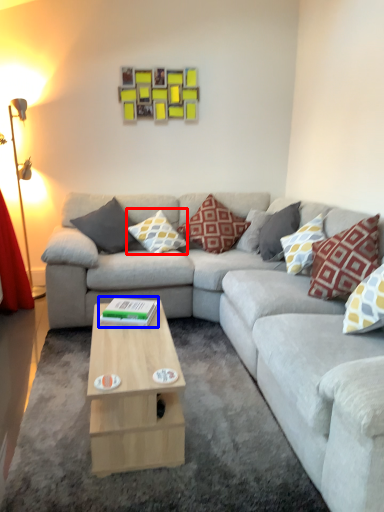
Question: Among these objects, which one is nearest to the camera, pillow (highlighted by a red box) or book (highlighted by a blue box)?

Choices:
 (A) pillow
 (B) book

Answer: (B)